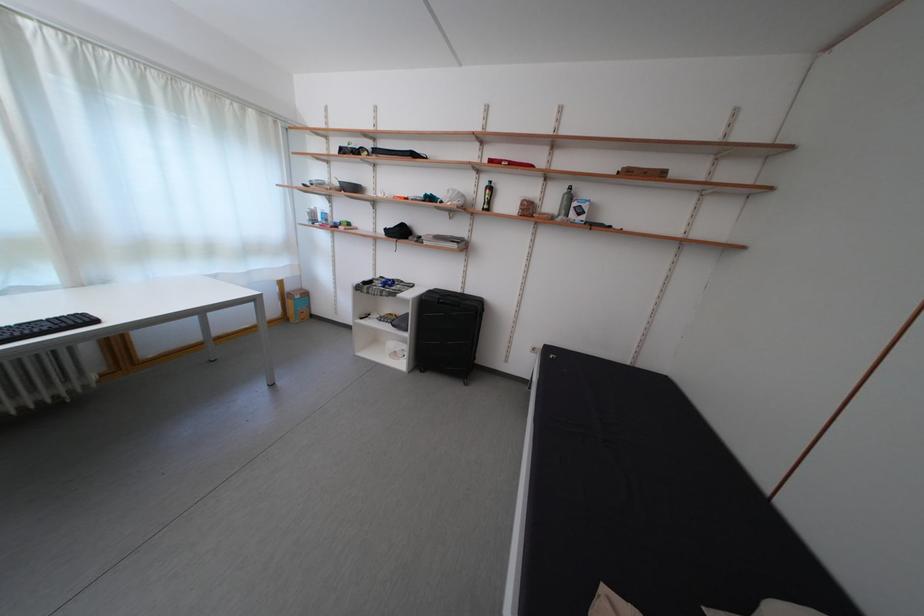
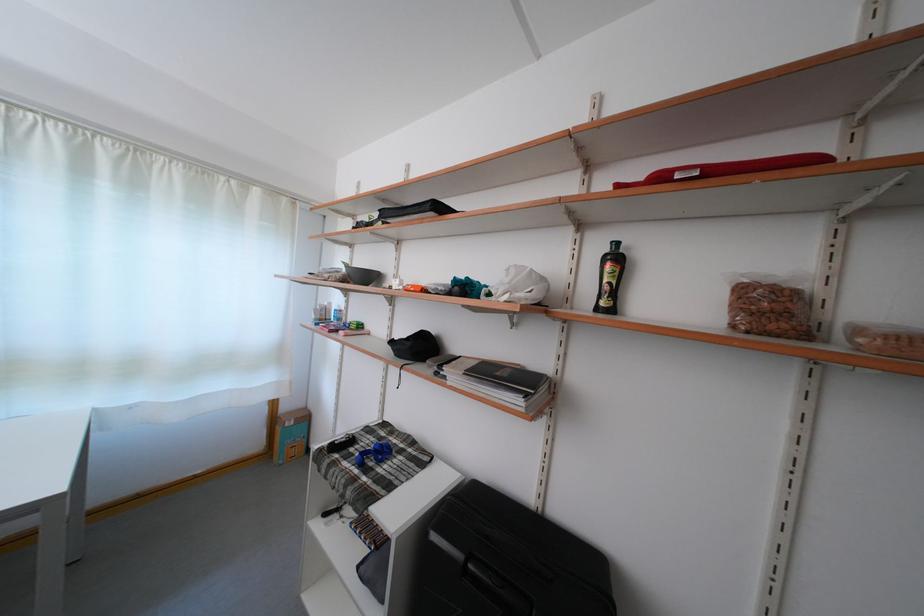
The point at (492,215) is marked in the first image. Where is the corresponding point in the second image?

(606, 314)